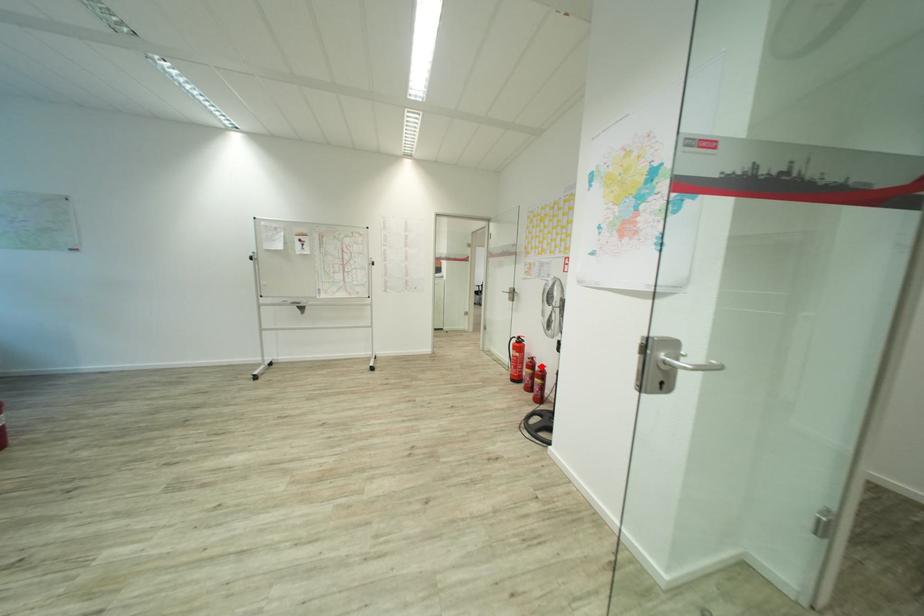
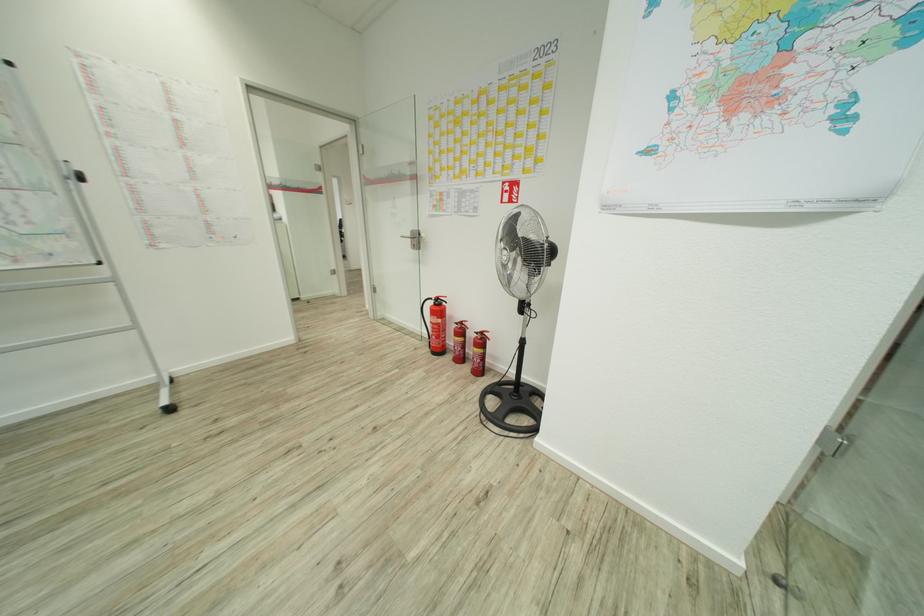
Question: I am providing you with two images of the same scene from different viewpoints. Given a red point in image1, look at the same physical point in image2. Is it:

Choices:
 (A) Closer to the viewpoint
 (B) Farther from the viewpoint

Answer: (B)